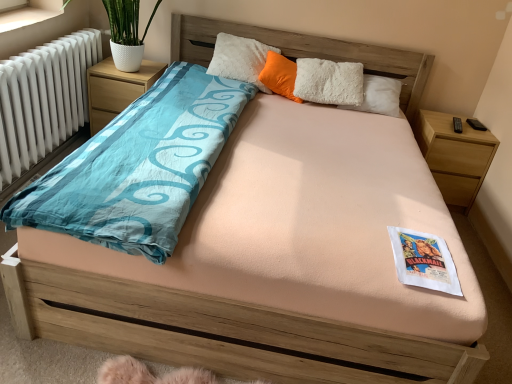
Find the location of a particular element. orange fluffy pillow at center is located at coordinates (280, 75).

In order to click on white smooth window sill at upper left in this screenshot , I will do `click(27, 13)`.

What do you see at coordinates (424, 261) in the screenshot? This screenshot has height=384, width=512. I see `white paper at center` at bounding box center [424, 261].

This screenshot has height=384, width=512. I want to click on wooden nightstand at left, the first nightstand in the left-to-right sequence, so click(117, 89).

Find the location of a particular element. orange fluffy pillow at center is located at coordinates (280, 75).

Which object is wider, wooden nightstand at left, the first nightstand in the left-to-right sequence, or wooden nightstand at right, the 1th nightstand in the right-to-left sequence?

Wider between the two is wooden nightstand at left, the first nightstand in the left-to-right sequence.

Would you say wooden nightstand at left, the 2th nightstand from the right, is inside or outside wooden nightstand at right, the 1th nightstand in the right-to-left sequence?

wooden nightstand at left, the 2th nightstand from the right, is outside wooden nightstand at right, the 1th nightstand in the right-to-left sequence.

How many degrees apart are the facing directions of wooden nightstand at left, the first nightstand in the left-to-right sequence, and wooden nightstand at right, the 1th nightstand in the right-to-left sequence?

0.388 degrees separate the facing orientations of wooden nightstand at left, the first nightstand in the left-to-right sequence, and wooden nightstand at right, the 1th nightstand in the right-to-left sequence.

In the scene shown: Considering the relative positions of white paper at center and orange fluffy pillow at center in the image provided, is white paper at center to the left of orange fluffy pillow at center from the viewer's perspective?

Incorrect, white paper at center is not on the left side of orange fluffy pillow at center.

Is white paper at center positioned with its back to orange fluffy pillow at center?

Yes, white paper at center is facing away from orange fluffy pillow at center.

From a real-world perspective, is white paper at center physically above orange fluffy pillow at center?

No, from a real-world perspective, white paper at center is not above orange fluffy pillow at center.

Is there a large distance between white paper at center and orange fluffy pillow at center?

Yes.

Is white matte radiator at left with orange fluffy pillow at center?

No.

At what (x,y) coordinates should I click in order to perform the action: click on pillow lying on the right of white matte radiator at left. Please return your answer as a coordinate pair (x, y). Looking at the image, I should click on (280, 75).

Considering the sizes of white matte radiator at left and orange fluffy pillow at center in the image, is white matte radiator at left bigger or smaller than orange fluffy pillow at center?

white matte radiator at left is bigger than orange fluffy pillow at center.

From the image's perspective, is white smooth window sill at upper left located above or below white matte radiator at left?

white smooth window sill at upper left is above white matte radiator at left.

Which object is closer to the camera taking this photo, white smooth window sill at upper left or white matte radiator at left?

white matte radiator at left is more forward.

What are the coordinates of `window sill that appears above the white matte radiator at left (from the image's perspective)` in the screenshot? It's located at (27, 13).

Considering the relative sizes of white smooth window sill at upper left and white paper at center in the image provided, is white smooth window sill at upper left smaller than white paper at center?

Yes, white smooth window sill at upper left is smaller than white paper at center.

Between white smooth window sill at upper left and white paper at center, which one is positioned behind?

white smooth window sill at upper left is behind.

Does white smooth window sill at upper left have a greater height compared to white paper at center?

In fact, white smooth window sill at upper left may be shorter than white paper at center.

Is white smooth window sill at upper left aimed at white paper at center?

No, white smooth window sill at upper left is not aimed at white paper at center.

From a real-world perspective, who is located higher, white smooth window sill at upper left or wooden nightstand at left, the 2th nightstand from the right?

white smooth window sill at upper left is physically above.

From the image's perspective, which object appears higher, white smooth window sill at upper left or wooden nightstand at left, the first nightstand in the left-to-right sequence?

white smooth window sill at upper left, from the image's perspective.

Which object is further away from the camera, white smooth window sill at upper left or wooden nightstand at left, the 2th nightstand from the right?

wooden nightstand at left, the 2th nightstand from the right, is more distant.

Visually, is wooden nightstand at left, the 2th nightstand from the right, positioned to the left or to the right of white matte radiator at left?

Clearly, wooden nightstand at left, the 2th nightstand from the right, is on the right of white matte radiator at left in the image.

Between wooden nightstand at left, the first nightstand in the left-to-right sequence, and white matte radiator at left, which one is positioned behind?

wooden nightstand at left, the first nightstand in the left-to-right sequence, is further from the camera.

From a real-world perspective, is wooden nightstand at left, the 2th nightstand from the right, above or below white matte radiator at left?

From a real-world perspective, wooden nightstand at left, the 2th nightstand from the right, is physically below white matte radiator at left.

In the image, there is a wooden nightstand at left, the 2th nightstand from the right. Where is `nightstand below it (from a real-world perspective)`? nightstand below it (from a real-world perspective) is located at coordinates (454, 155).

The image size is (512, 384). I want to click on magazine on the right of the orange fluffy pillow at center, so click(x=424, y=261).

From the image, which object appears to be nearer to white paper at center, orange fluffy pillow at center or wooden nightstand at right, the 2th nightstand from the left?

wooden nightstand at right, the 2th nightstand from the left, is closer to white paper at center.

Looking at the image, which one is located closer to white matte radiator at left, orange fluffy pillow at center or wooden nightstand at right, the 1th nightstand in the right-to-left sequence?

Based on the image, orange fluffy pillow at center appears to be nearer to white matte radiator at left.

When comparing their distances from white smooth window sill at upper left, does white paper at center or wooden nightstand at left, the first nightstand in the left-to-right sequence, seem further?

white paper at center is further to white smooth window sill at upper left.

Considering their positions, is wooden nightstand at right, the 1th nightstand in the right-to-left sequence, positioned further to orange fluffy pillow at center than white matte radiator at left?

white matte radiator at left is positioned further to the anchor orange fluffy pillow at center.

Based on the photo, when comparing their distances from wooden nightstand at left, the first nightstand in the left-to-right sequence, does wooden nightstand at right, the 2th nightstand from the left, or white paper at center seem closer?

Among the two, wooden nightstand at right, the 2th nightstand from the left, is located nearer to wooden nightstand at left, the first nightstand in the left-to-right sequence.

From the image, which object appears to be nearer to orange fluffy pillow at center, white smooth window sill at upper left or white matte radiator at left?

white matte radiator at left lies closer to orange fluffy pillow at center than the other object.

Estimate the real-world distances between objects in this image. Which object is closer to wooden nightstand at left, the first nightstand in the left-to-right sequence, white matte radiator at left or white smooth window sill at upper left?

white matte radiator at left is positioned closer to the anchor wooden nightstand at left, the first nightstand in the left-to-right sequence.

Considering their positions, is orange fluffy pillow at center positioned further to wooden nightstand at right, the 1th nightstand in the right-to-left sequence, than white paper at center?

white paper at center lies further to wooden nightstand at right, the 1th nightstand in the right-to-left sequence, than the other object.

What are the coordinates of `magazine located between white matte radiator at left and wooden nightstand at right, the 1th nightstand in the right-to-left sequence, in the left-right direction` in the screenshot? It's located at (424, 261).

The image size is (512, 384). Identify the location of radiator situated between white smooth window sill at upper left and white paper at center from left to right. (42, 100).

The image size is (512, 384). Find the location of `nightstand between white matte radiator at left and white paper at center in the horizontal direction`. nightstand between white matte radiator at left and white paper at center in the horizontal direction is located at coordinates coord(117,89).

Find the location of a particular element. The height and width of the screenshot is (384, 512). nightstand between white smooth window sill at upper left and wooden nightstand at right, the 1th nightstand in the right-to-left sequence, from left to right is located at coordinates (117, 89).